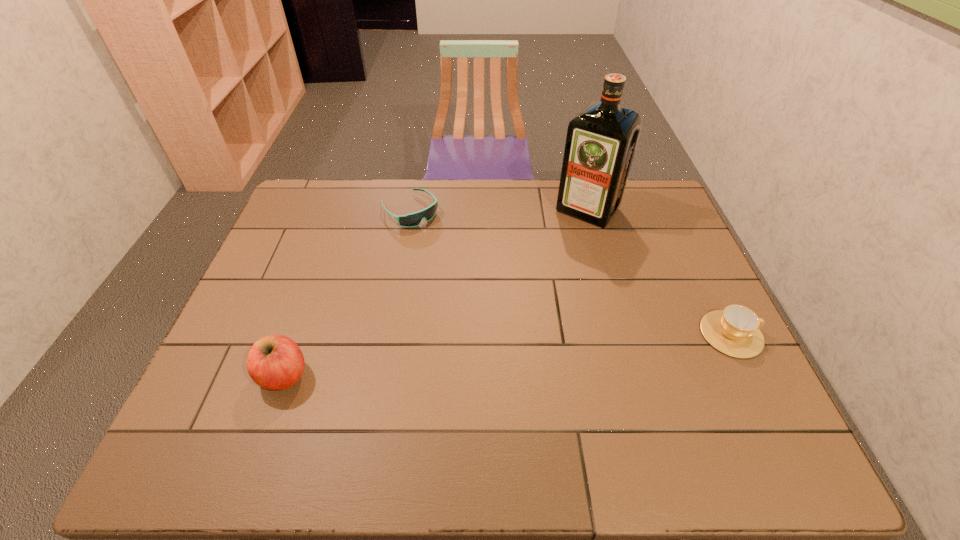
The image size is (960, 540). In the image, there is a desktop. What are the coordinates of `vacant space at the far edge` in the screenshot? It's located at (553, 218).

Locate an element on the screen. The height and width of the screenshot is (540, 960). vacant space at the near edge is located at coordinates (361, 382).

Where is `vacant space at the left edge of the desktop`? The width and height of the screenshot is (960, 540). vacant space at the left edge of the desktop is located at coordinates (296, 225).

The width and height of the screenshot is (960, 540). Find the location of `vacant space at the far left corner`. vacant space at the far left corner is located at coordinates (324, 194).

Find the location of `free space at the near left corner`. free space at the near left corner is located at coordinates (248, 390).

The height and width of the screenshot is (540, 960). Find the location of `free space at the far right corner of the desktop`. free space at the far right corner of the desktop is located at coordinates (659, 188).

This screenshot has width=960, height=540. What are the coordinates of `free space between the cup and the shortest object` in the screenshot? It's located at (570, 272).

The height and width of the screenshot is (540, 960). What are the coordinates of `empty location between the cup and the leftmost object` in the screenshot? It's located at (508, 355).

You are a GUI agent. You are given a task and a screenshot of the screen. Output one action in this format:
    pyautogui.click(x=<x>, y=<y>)
    Task: Click on the free space between the apple and the liquor
    This screenshot has width=960, height=540.
    Given the screenshot: What is the action you would take?
    pyautogui.click(x=436, y=293)

Identify the location of free space between the shortest object and the cup. (570, 272).